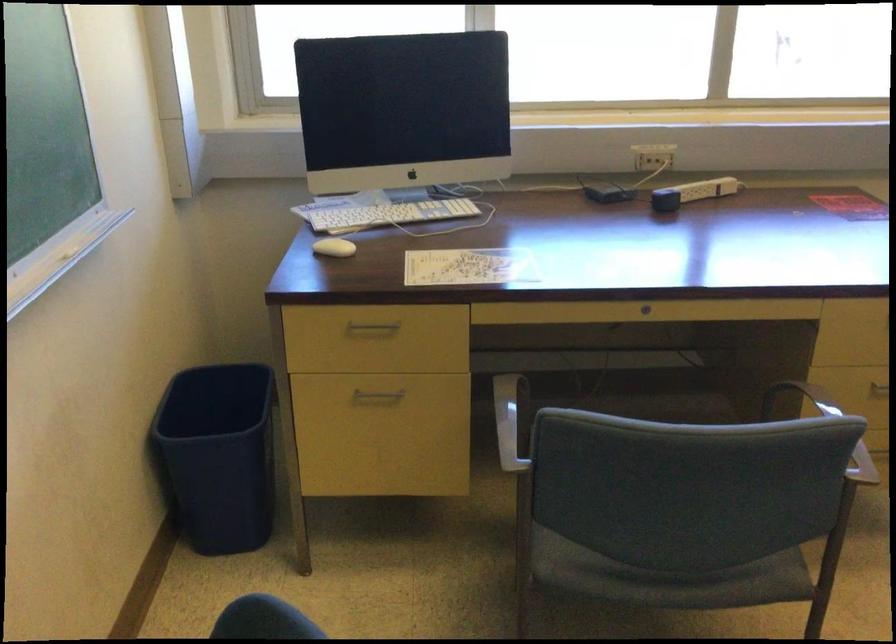
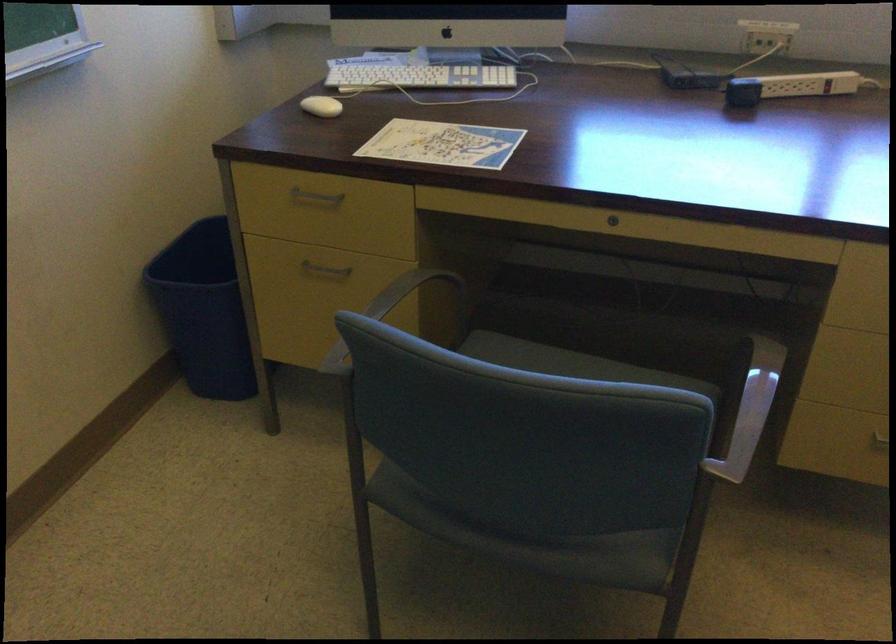
The point at (224, 460) is marked in the first image. Where is the corresponding point in the second image?

(202, 310)